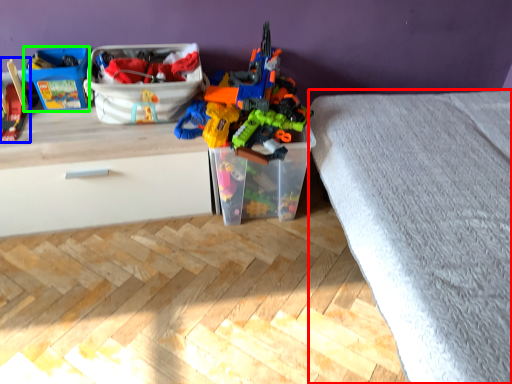
Question: Which object is the closest to the bed frame (highlighted by a red box)? Choose among these: toy (highlighted by a blue box) or storage box (highlighted by a green box).

Choices:
 (A) toy
 (B) storage box

Answer: (B)